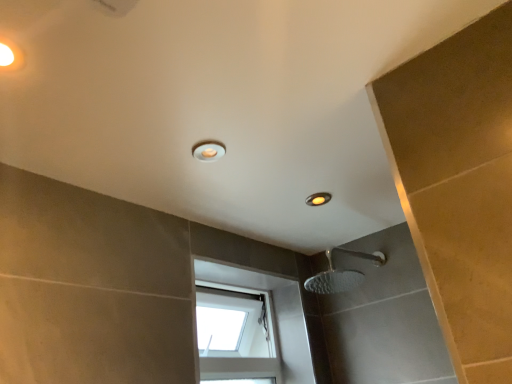
Question: In terms of width, does transparent glass window at center look wider or thinner when compared to matte white light fixture at upper center?

Choices:
 (A) thin
 (B) wide

Answer: (B)

Question: Is transparent glass window at center taller or shorter than matte white light fixture at upper center?

Choices:
 (A) short
 (B) tall

Answer: (B)

Question: From the image's perspective, is transparent glass window at center above or below matte white light fixture at upper center?

Choices:
 (A) above
 (B) below

Answer: (B)

Question: From the image's perspective, is matte white light fixture at upper center above or below transparent glass window at center?

Choices:
 (A) below
 (B) above

Answer: (B)

Question: Is point (215, 157) closer or farther from the camera than point (222, 302)?

Choices:
 (A) farther
 (B) closer

Answer: (B)

Question: From their relative heights in the image, would you say matte white light fixture at upper center is taller or shorter than transparent glass window at center?

Choices:
 (A) tall
 (B) short

Answer: (B)

Question: Which is correct: matte white light fixture at upper center is inside transparent glass window at center, or outside of it?

Choices:
 (A) inside
 (B) outside

Answer: (B)